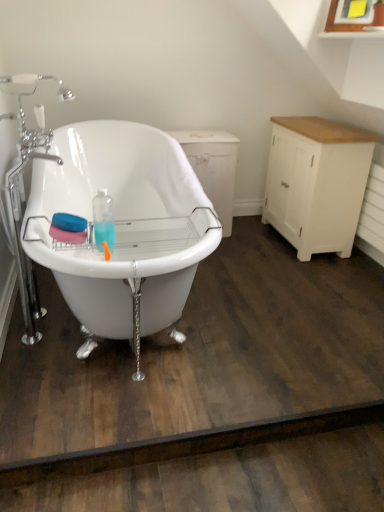
This screenshot has height=512, width=384. I want to click on blank space above white painted wood cabinet at right (from a real-world perspective), so click(x=322, y=130).